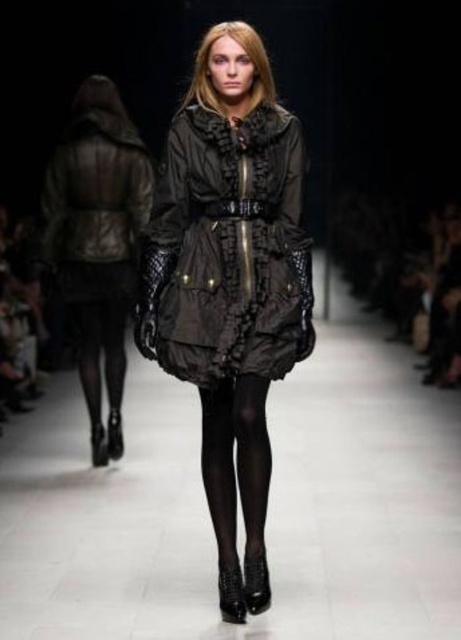
Is matte black coat at center thinner than leather-like brown coat at left?

No.

Does point (252, 268) come farther from viewer compared to point (119, 100)?

No, (252, 268) is closer to viewer.

Locate an element on the screen. The image size is (461, 640). matte black coat at center is located at coordinates (230, 282).

Locate an element on the screen. matte black coat at center is located at coordinates (230, 282).

Between matte black dress at center and leather-like brown coat at left, which one has less height?

matte black dress at center

Between point (259, 140) and point (68, 227), which one is positioned in front?

Point (259, 140) is in front.

Does point (177, 228) lie behind point (133, 244)?

No, (177, 228) is closer to viewer.

This screenshot has width=461, height=640. I want to click on matte black dress at center, so click(229, 248).

Is leather-like brown coat at left positioned in front of black sheer tights at center?

No, it is not.

Locate an element on the screen. leather-like brown coat at left is located at coordinates (95, 180).

At what (x,y) coordinates should I click in order to perform the action: click on leather-like brown coat at left. Please return your answer as a coordinate pair (x, y). Image resolution: width=461 pixels, height=640 pixels. Looking at the image, I should click on (95, 180).

Where is `leather-like brown coat at left`? This screenshot has height=640, width=461. leather-like brown coat at left is located at coordinates (95, 180).